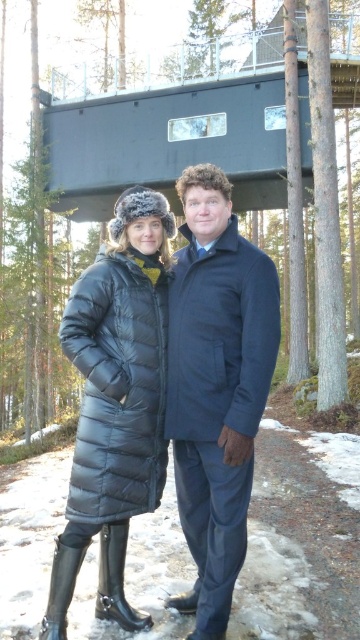
Question: Which object is closer to the camera taking this photo?

Choices:
 (A) dark blue wool coat at center
 (B) matte black coat at center

Answer: (B)

Question: Is matte black coat at center positioned in front of dark blue wool coat at center?

Choices:
 (A) no
 (B) yes

Answer: (B)

Question: Is matte black coat at center to the right of dark blue wool coat at center from the viewer's perspective?

Choices:
 (A) no
 (B) yes

Answer: (A)

Question: Among these points, which one is nearest to the camera?

Choices:
 (A) (227, 205)
 (B) (250, 252)

Answer: (B)

Question: Can you confirm if matte black coat at center is positioned to the left of dark blue wool coat at center?

Choices:
 (A) yes
 (B) no

Answer: (A)